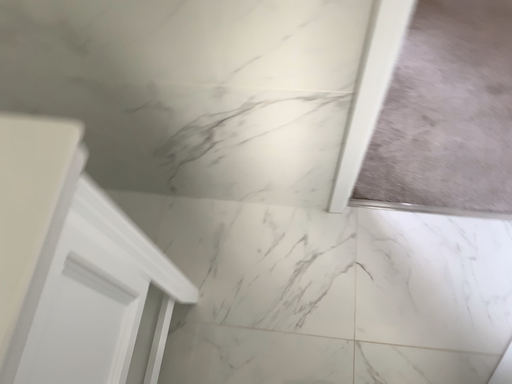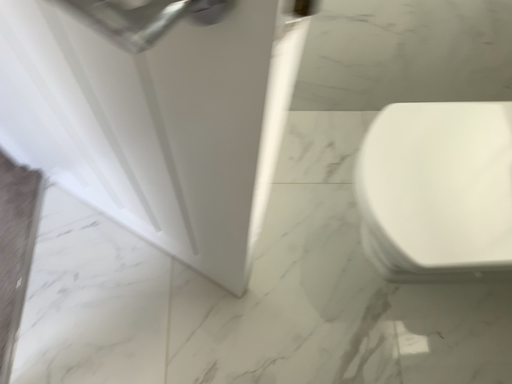
Question: How did the camera likely rotate when shooting the video?

Choices:
 (A) rotated right
 (B) rotated left

Answer: (A)